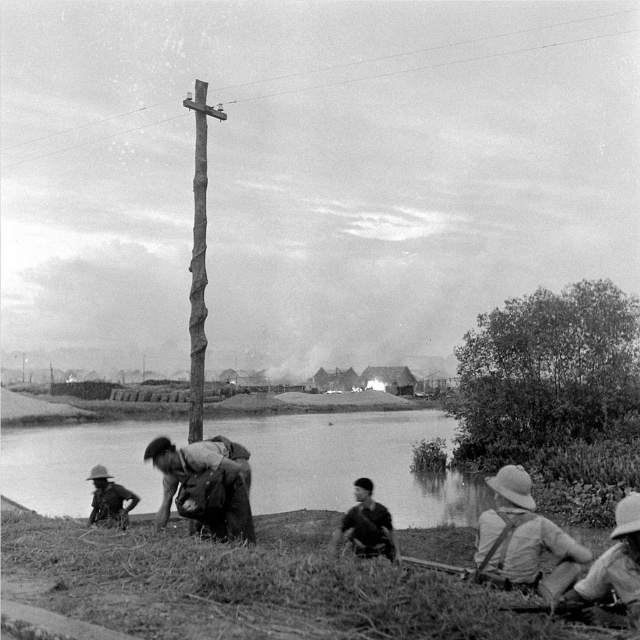
You are a soldier in the scene and need to hide behind the thick foliage at right. Based on its position, can you estimate how far to the right and how far down from the top of the image you should move to reach it?

The thick foliage at right is located at point coordinates approximately 58.3 percent to the right and 85.5 percent down from the top of the image. So, move about 58.3 percent to the right and 85.5 percent down from the top to reach it.